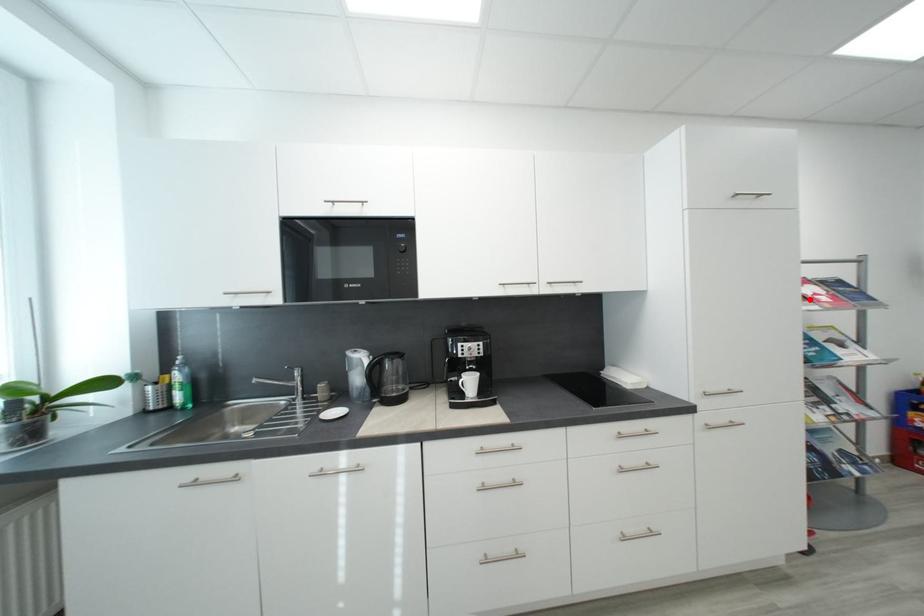
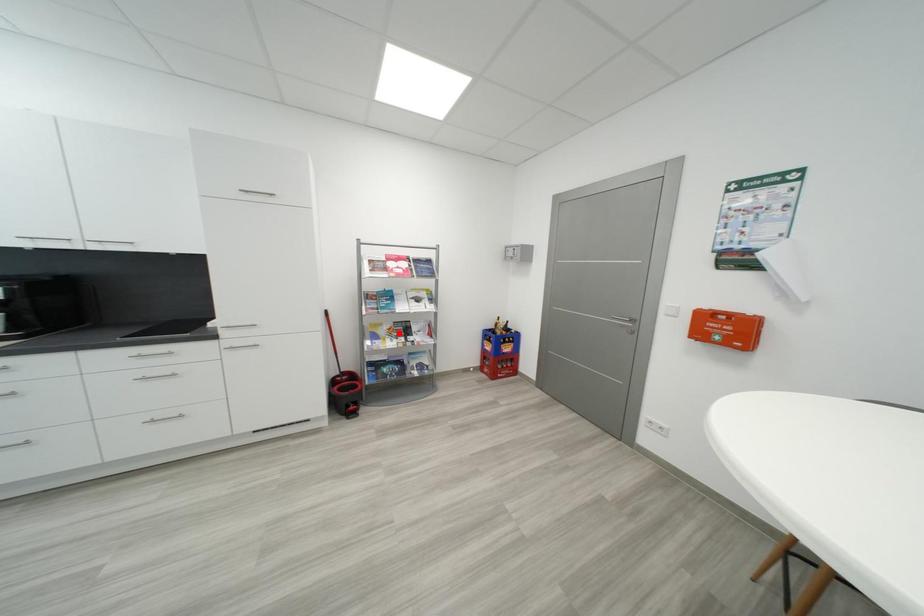
I am providing you with two images of the same scene from different viewpoints. A red point is marked on the first image and another point is marked on the second image. Do the highlighted points in image1 and image2 indicate the same real-world spot?

No